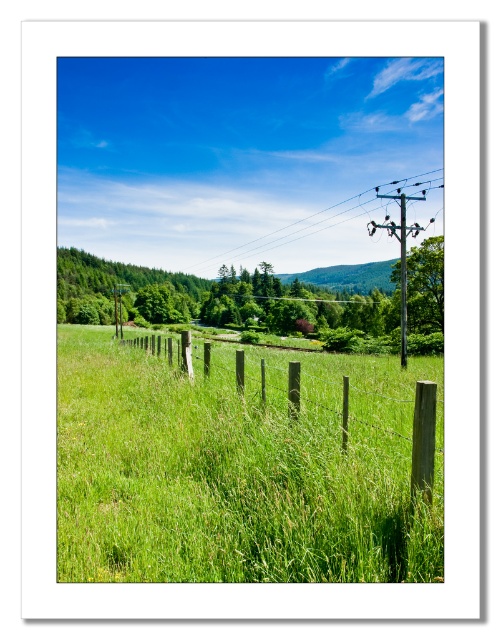
Does point (354, 237) come closer to viewer compared to point (344, 380)?

No.

Can you confirm if metallic wire at upper right is taller than brown wooden fence at center?

Indeed, metallic wire at upper right has a greater height compared to brown wooden fence at center.

Does point (199, 202) come behind point (420, 401)?

Yes, it is.

Locate an element on the screen. metallic wire at upper right is located at coordinates (315, 237).

Does metallic wire at upper right appear on the right side of smooth wooden telegraph pole at right?

In fact, metallic wire at upper right is to the left of smooth wooden telegraph pole at right.

Does metallic wire at upper right have a lesser width compared to smooth wooden telegraph pole at right?

In fact, metallic wire at upper right might be wider than smooth wooden telegraph pole at right.

What do you see at coordinates (315, 237) in the screenshot? I see `metallic wire at upper right` at bounding box center [315, 237].

The height and width of the screenshot is (640, 501). In order to click on metallic wire at upper right in this screenshot , I will do `click(315, 237)`.

Between brown wooden fence at center and smooth wooden telegraph pole at right, which one appears on the left side from the viewer's perspective?

From the viewer's perspective, brown wooden fence at center appears more on the left side.

Which is more to the right, brown wooden fence at center or smooth wooden telegraph pole at right?

From the viewer's perspective, smooth wooden telegraph pole at right appears more on the right side.

This screenshot has width=501, height=640. Find the location of `brown wooden fence at center`. brown wooden fence at center is located at coordinates (423, 435).

This screenshot has width=501, height=640. Identify the location of brown wooden fence at center. (423, 435).